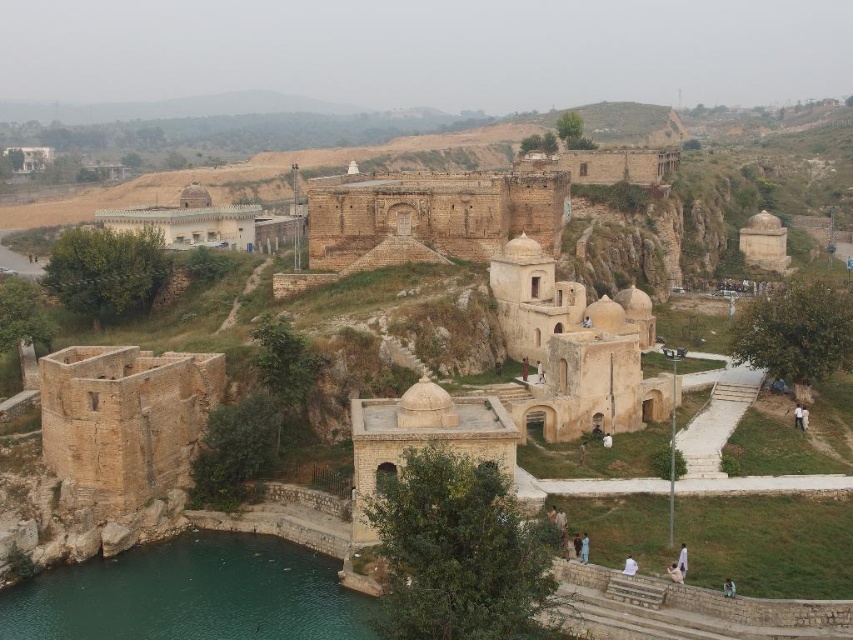
You are an architect visiting the historical site and need to determine the relative sizes of the structures. Which object from the scene is bigger between the light brown stone palace at upper left and the white cloth at lower center?

The light brown stone palace at upper left is larger in size than the white cloth at lower center according to the description.

You are standing at the bottom of the hill and see the light brown stone palace at upper left and the white cloth at lower center. Which object is higher in elevation?

The light brown stone palace at upper left is higher in elevation than the white cloth at lower center because it is positioned above it.